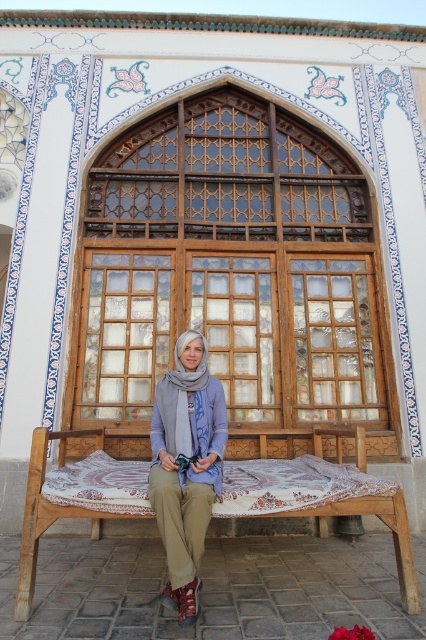
You are standing in front of the ornate structure and see the wooden bench with patterned cushion at center and the gray soft scarf at center. Which object is positioned lower?

The wooden bench with patterned cushion at center is located below gray soft scarf at center, so it is positioned lower.